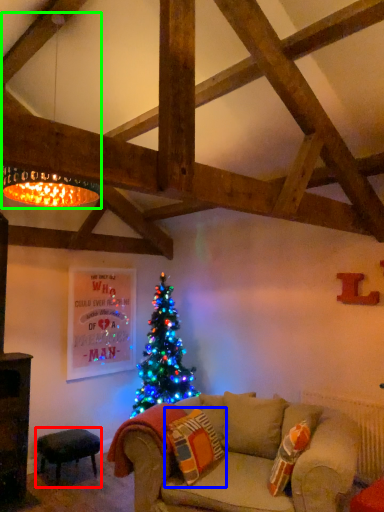
Question: Based on their relative distances, which object is nearer to stool (highlighted by a red box)? Choose from pillow (highlighted by a blue box) and lamp (highlighted by a green box).

Choices:
 (A) pillow
 (B) lamp

Answer: (A)